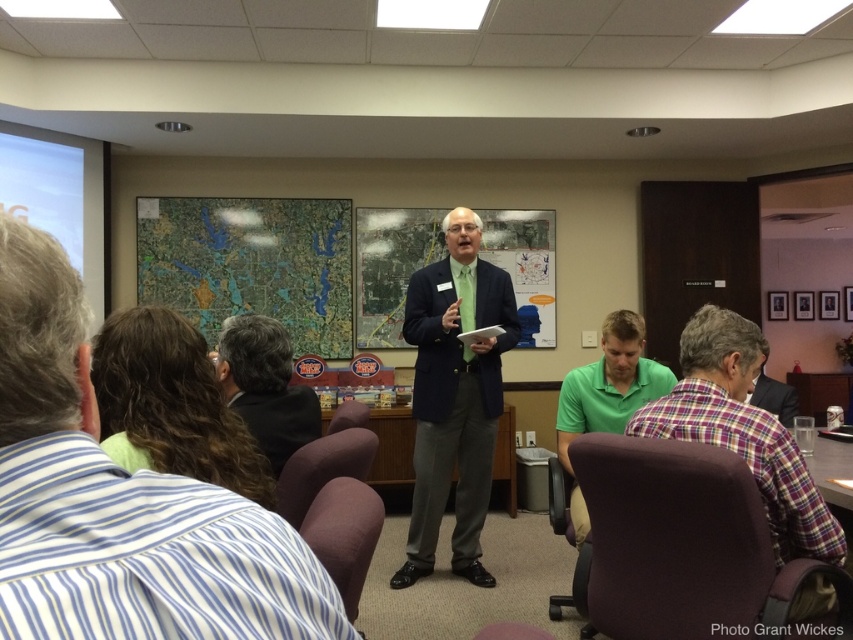
You are an event planner trying to choose between two outfits for a formal presentation. You have a green matte suit at center and a plaid fabric shirt at center. Based on the image, which outfit would you recommend if you want to appear more authoritative and commanding?

The green matte suit at center has a larger width than the plaid fabric shirt at center, making it appear more authoritative and commanding.

You are standing in the conference room and want to locate the green matte suit at center. What are the coordinates where you can find it?

The green matte suit at center is located at coordinates point (454, 396).

You are a person in the conference room and you want to move from the dark brown hair at center to the green matte shirt at lower center. Can you walk directly between them without any obstacles?

The distance between dark brown hair at center and green matte shirt at lower center is 4.38 feet, so yes, you can walk directly between them without any obstacles since the distance is sufficient for movement.